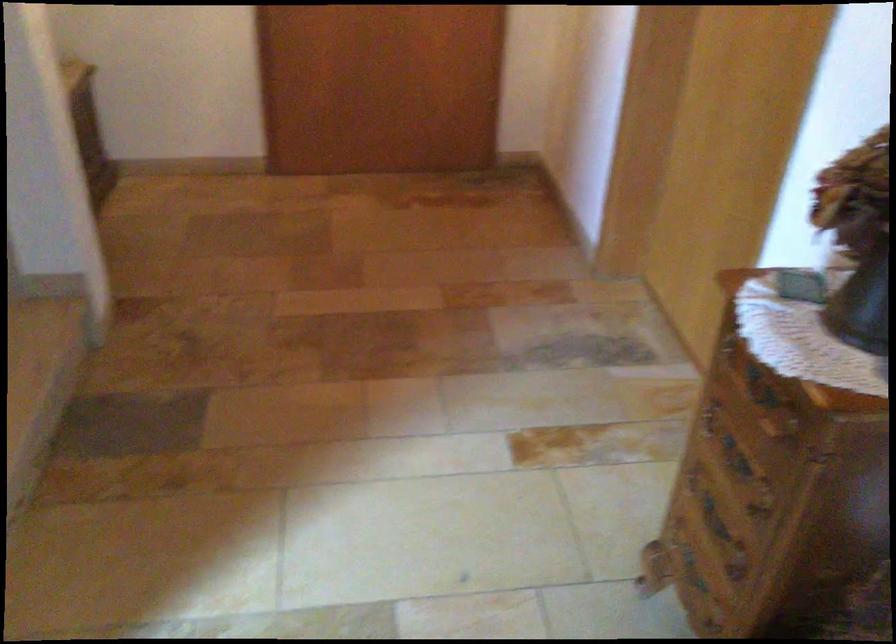
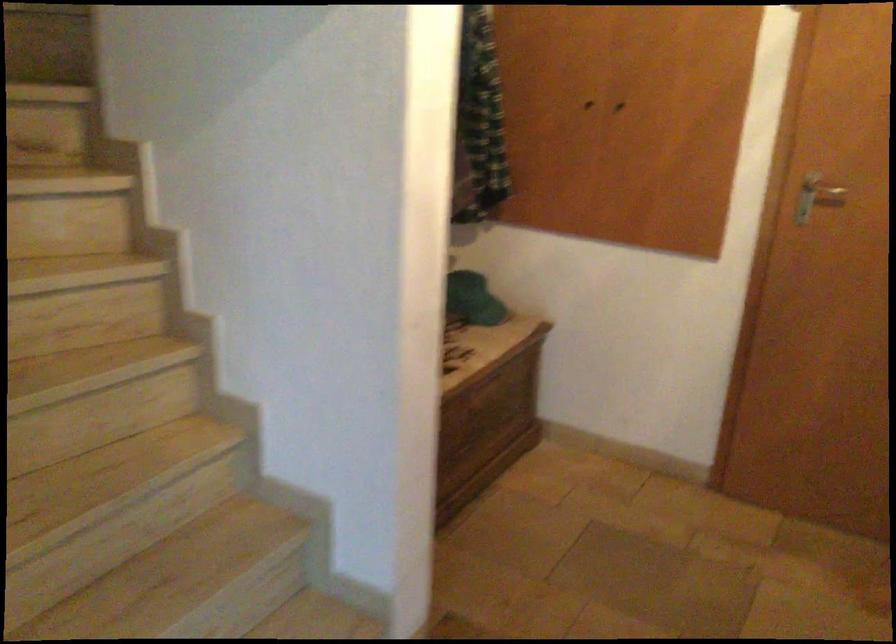
Question: How did the camera likely rotate?

Choices:
 (A) Left
 (B) Right
 (C) Up
 (D) Down

Answer: (A)